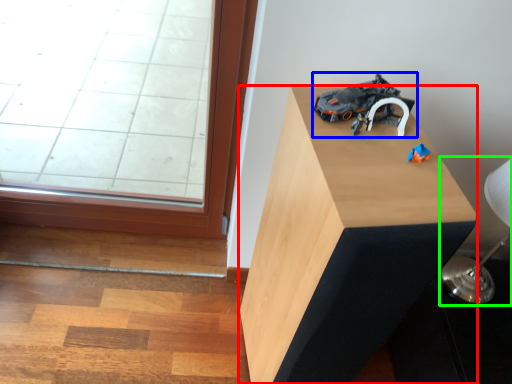
Question: Which is farther away from furniture (highlighted by a red box)? toy (highlighted by a blue box) or table lamp (highlighted by a green box)?

Choices:
 (A) toy
 (B) table lamp

Answer: (B)